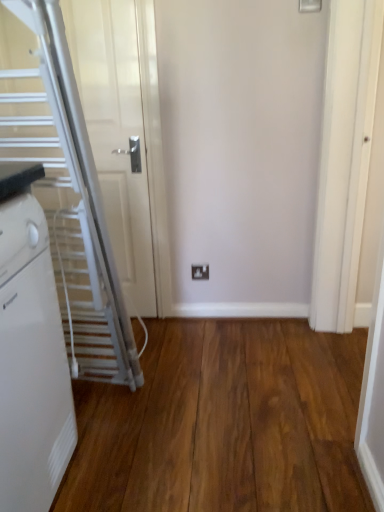
You are a GUI agent. You are given a task and a screenshot of the screen. Output one action in this format:
    pyautogui.click(x=<x>, y=<y>)
    Task: Click on the free space above brown wood flooring at center (from a real-world perspective)
    Image resolution: width=384 pixels, height=512 pixels.
    Given the screenshot: What is the action you would take?
    pyautogui.click(x=207, y=394)